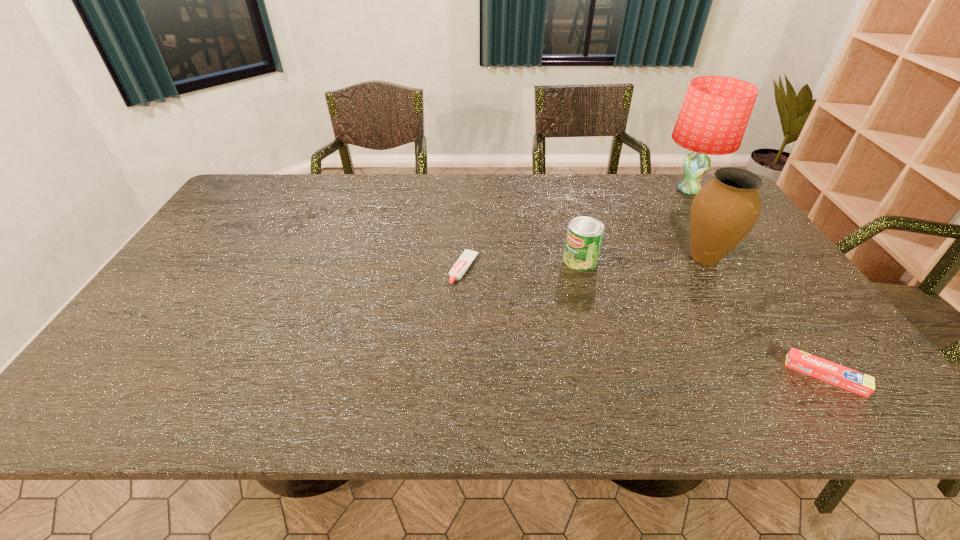
The height and width of the screenshot is (540, 960). In order to click on the tallest object in this screenshot , I will do `click(714, 115)`.

The image size is (960, 540). In order to click on the farthest object in this screenshot , I will do `click(714, 115)`.

I want to click on the second tallest object, so click(724, 211).

Where is `the second object from left to right`? Image resolution: width=960 pixels, height=540 pixels. the second object from left to right is located at coordinates (584, 238).

Where is `can`? This screenshot has height=540, width=960. can is located at coordinates (584, 238).

Find the location of a particular element. This screenshot has width=960, height=540. the leftmost object is located at coordinates click(x=460, y=267).

The width and height of the screenshot is (960, 540). I want to click on the left toothpaste, so click(x=460, y=267).

Locate an element on the screen. The width and height of the screenshot is (960, 540). the right toothpaste is located at coordinates (849, 379).

The width and height of the screenshot is (960, 540). What are the coordinates of `the nearer toothpaste` in the screenshot? It's located at (849, 379).

Where is `free space located 0.120m on the front-facing side of the lampshade`? The height and width of the screenshot is (540, 960). free space located 0.120m on the front-facing side of the lampshade is located at coordinates 624,190.